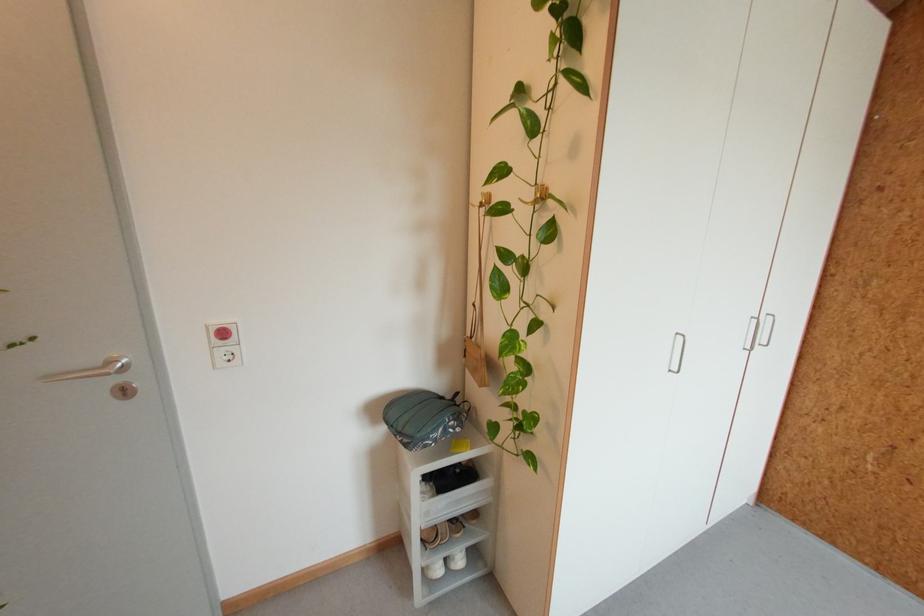
At what (x,y) coordinates should I click in order to perform the action: click on red wall button. Please return your answer as a coordinate pair (x, y). The height and width of the screenshot is (616, 924). Looking at the image, I should click on (223, 334).